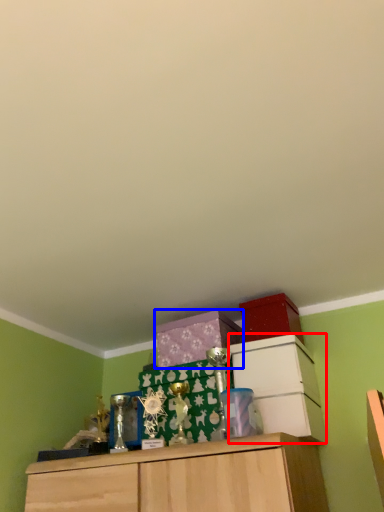
Question: Which object is closer to the camera taking this photo, cabinetry (highlighted by a red box) or cabinetry (highlighted by a blue box)?

Choices:
 (A) cabinetry
 (B) cabinetry

Answer: (A)